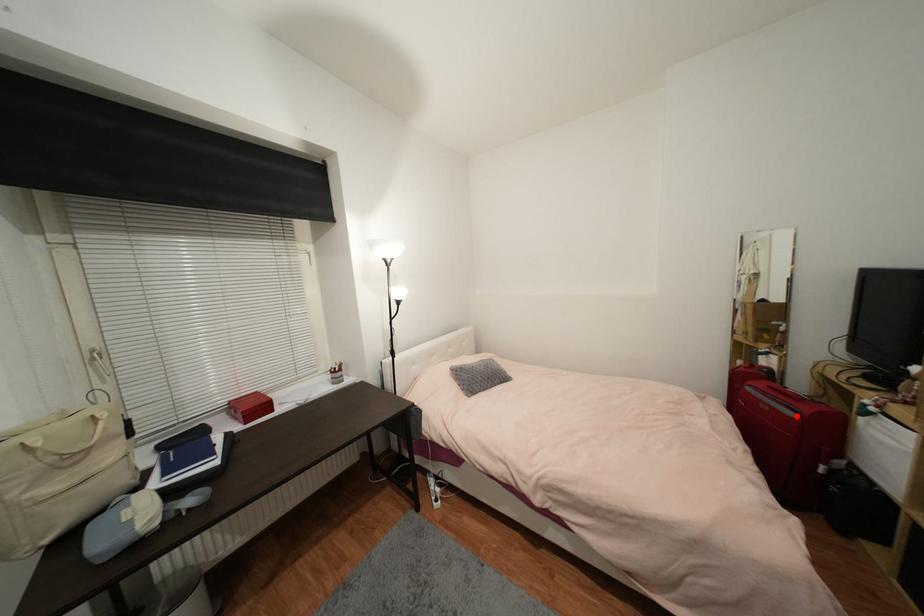
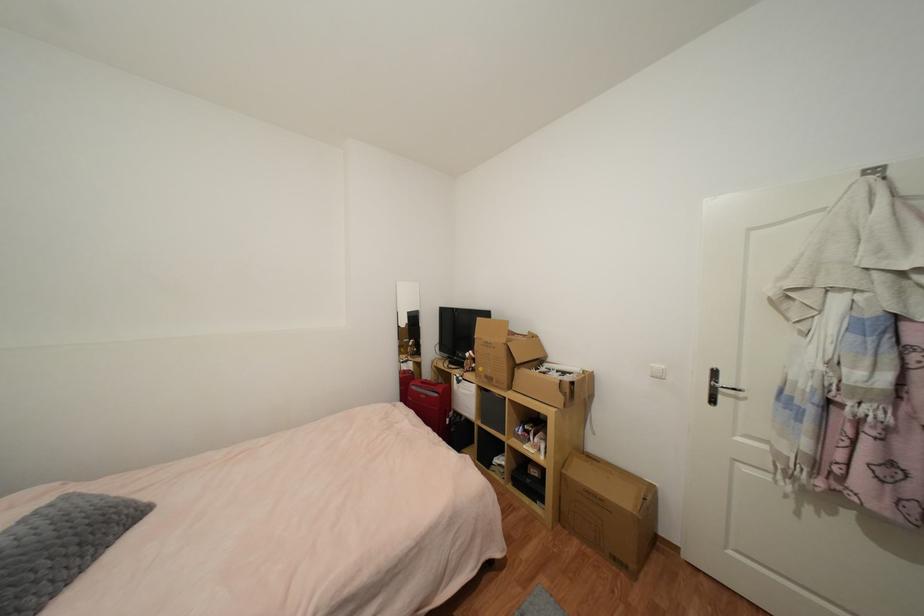
Question: I am providing you with two images of the same scene from different viewpoints. Given a red point in image1, look at the same physical point in image2. Is it:

Choices:
 (A) Closer to the viewpoint
 (B) Farther from the viewpoint

Answer: (B)